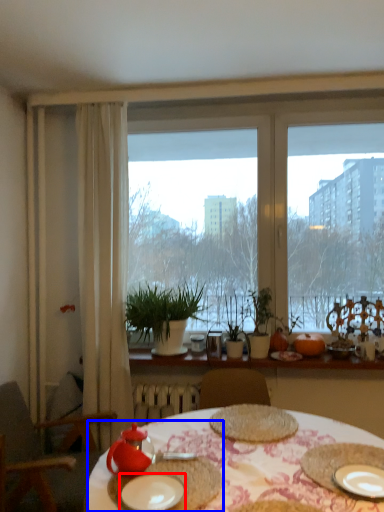
Question: Which of the following is the farthest to the observer, plate (highlighted by a red box) or meal (highlighted by a blue box)?

Choices:
 (A) plate
 (B) meal

Answer: (B)